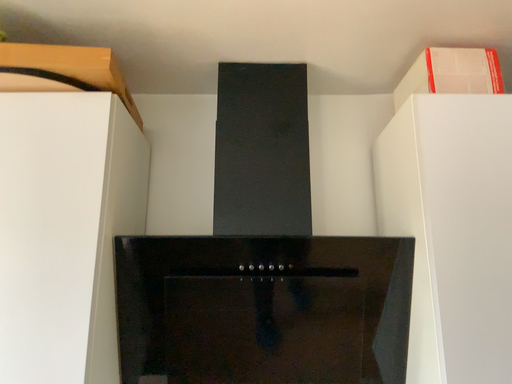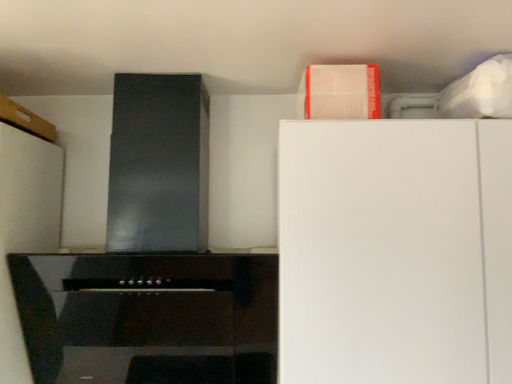
Question: How did the camera likely rotate when shooting the video?

Choices:
 (A) rotated upward
 (B) rotated downward

Answer: (B)